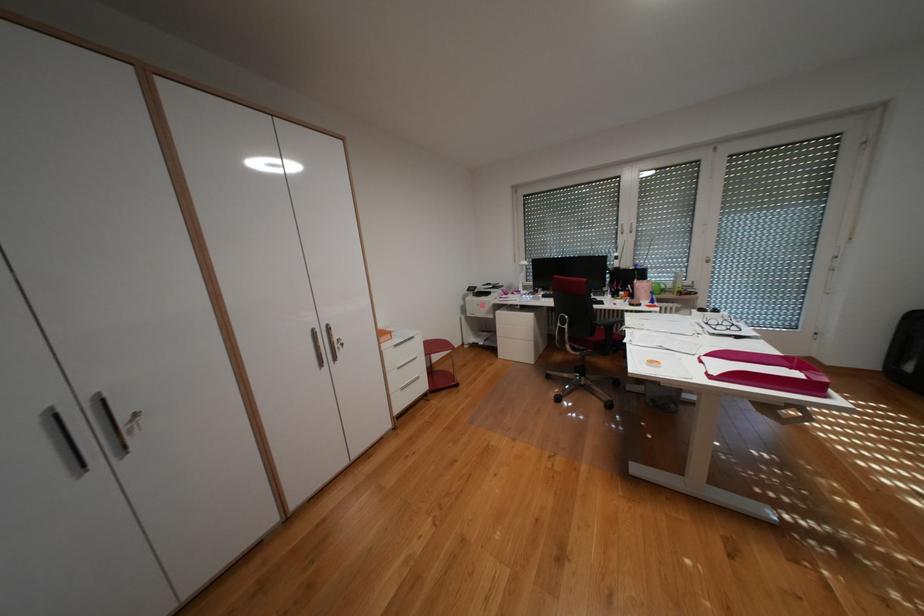
What do you see at coordinates (630, 231) in the screenshot? The width and height of the screenshot is (924, 616). I see `the white window handle` at bounding box center [630, 231].